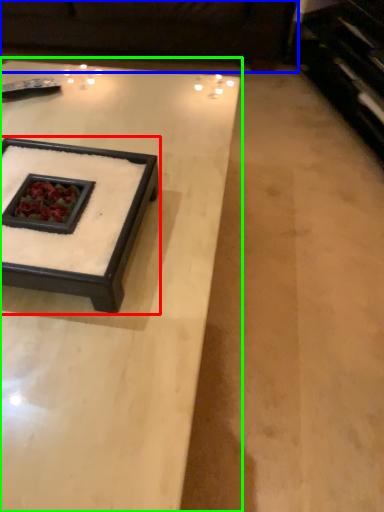
Question: Estimate the real-world distances between objects in this image. Which object is farther from coffee table (highlighted by a red box), couch (highlighted by a blue box) or coffee table (highlighted by a green box)?

Choices:
 (A) couch
 (B) coffee table

Answer: (A)